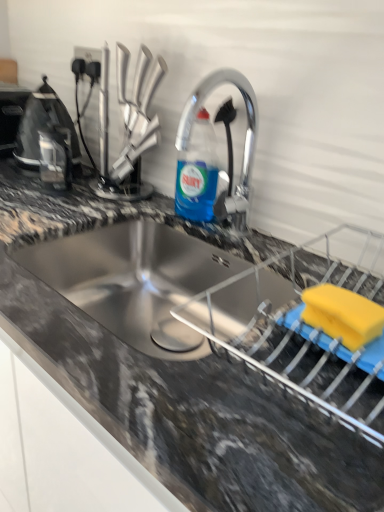
This screenshot has height=512, width=384. I want to click on free location in front of black plastic kettle at left, which appears as the second appliance when viewed from the left, so click(x=25, y=182).